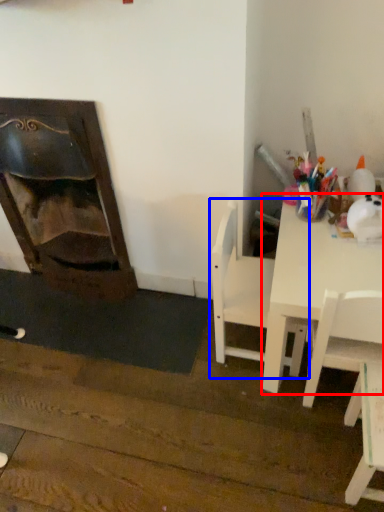
Question: Among these objects, which one is farthest to the camera, table (highlighted by a red box) or chair (highlighted by a blue box)?

Choices:
 (A) table
 (B) chair

Answer: (B)